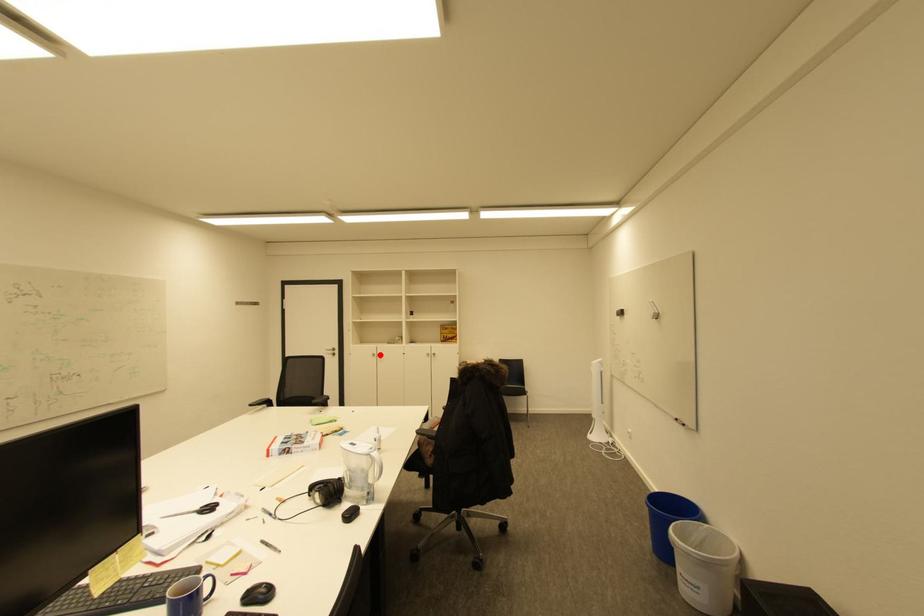
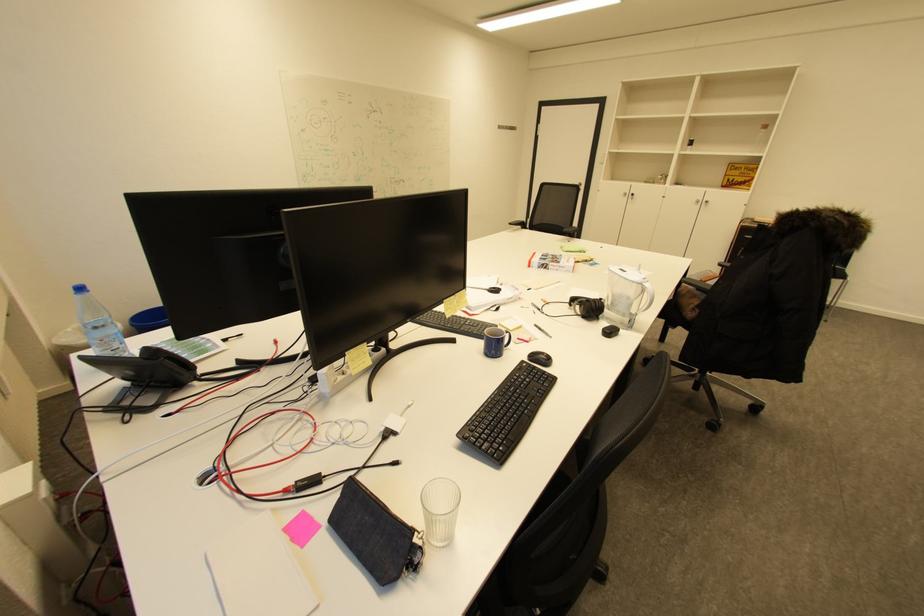
Where in the second image is the point corresponding to the highlighted location from the first image?

(630, 195)